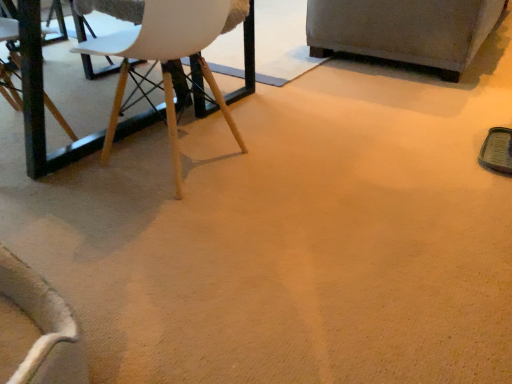
Where is `white matte chair at upper left`? The image size is (512, 384). white matte chair at upper left is located at coordinates (160, 55).

Describe the element at coordinates (160, 55) in the screenshot. I see `white matte chair at upper left` at that location.

Measure the distance between white matte chair at upper left and camera.

The depth of white matte chair at upper left is 3.60 feet.

The width and height of the screenshot is (512, 384). Describe the element at coordinates (404, 30) in the screenshot. I see `velvet gray armchair at upper right` at that location.

This screenshot has width=512, height=384. Find the location of `velvet gray armchair at upper right`. velvet gray armchair at upper right is located at coordinates (404, 30).

I want to click on white matte chair at upper left, so click(160, 55).

Is velvet gray armchair at upper right to the right of white matte chair at upper left from the viewer's perspective?

Yes.

Who is more distant, velvet gray armchair at upper right or white matte chair at upper left?

velvet gray armchair at upper right is further away from the camera.

Is point (464, 44) positioned after point (202, 13)?

Yes.

From the image's perspective, does velvet gray armchair at upper right appear lower than white matte chair at upper left?

No, from the image's perspective, velvet gray armchair at upper right is not below white matte chair at upper left.

Looking at this image, from a real-world perspective, which object stands above the other?

white matte chair at upper left, from a real-world perspective.

Which object is wider, velvet gray armchair at upper right or white matte chair at upper left?

With larger width is velvet gray armchair at upper right.

Who is shorter, velvet gray armchair at upper right or white matte chair at upper left?

velvet gray armchair at upper right is shorter.

Between velvet gray armchair at upper right and white matte chair at upper left, which one has smaller size?

With smaller size is white matte chair at upper left.

Do you think velvet gray armchair at upper right is within white matte chair at upper left, or outside of it?

The correct answer is: outside.

Is velvet gray armchair at upper right far away from white matte chair at upper left?

That's right, there is a large distance between velvet gray armchair at upper right and white matte chair at upper left.

Is velvet gray armchair at upper right looking in the opposite direction of white matte chair at upper left?

No, white matte chair at upper left is not at the back of velvet gray armchair at upper right.

Measure the distance between velvet gray armchair at upper right and white matte chair at upper left.

A distance of 1.25 meters exists between velvet gray armchair at upper right and white matte chair at upper left.

Where is `chair positioned vertically above the velvet gray armchair at upper right (from a real-world perspective)`? This screenshot has height=384, width=512. chair positioned vertically above the velvet gray armchair at upper right (from a real-world perspective) is located at coordinates (160, 55).

Which is more to the left, white matte chair at upper left or velvet gray armchair at upper right?

white matte chair at upper left is more to the left.

Does white matte chair at upper left come behind velvet gray armchair at upper right?

No, white matte chair at upper left is in front of velvet gray armchair at upper right.

Is point (104, 154) in front of point (339, 25)?

Yes.

From the image's perspective, who appears lower, white matte chair at upper left or velvet gray armchair at upper right?

white matte chair at upper left, from the image's perspective.

From a real-world perspective, between white matte chair at upper left and velvet gray armchair at upper right, who is vertically lower?

From a 3D spatial view, velvet gray armchair at upper right is below.

Which of these two, white matte chair at upper left or velvet gray armchair at upper right, is thinner?

With smaller width is white matte chair at upper left.

Which of these two, white matte chair at upper left or velvet gray armchair at upper right, stands shorter?

Standing shorter between the two is velvet gray armchair at upper right.

Based on the photo, considering the sizes of white matte chair at upper left and velvet gray armchair at upper right in the image, is white matte chair at upper left bigger or smaller than velvet gray armchair at upper right?

white matte chair at upper left is smaller than velvet gray armchair at upper right.

Do you think white matte chair at upper left is within velvet gray armchair at upper right, or outside of it?

white matte chair at upper left cannot be found inside velvet gray armchair at upper right.

Is white matte chair at upper left next to velvet gray armchair at upper right and touching it?

No, white matte chair at upper left is not in contact with velvet gray armchair at upper right.

Is white matte chair at upper left aimed at velvet gray armchair at upper right?

No, white matte chair at upper left is not oriented towards velvet gray armchair at upper right.

Can you tell me how much white matte chair at upper left and velvet gray armchair at upper right differ in facing direction?

The angular difference between white matte chair at upper left and velvet gray armchair at upper right is 2.23 degrees.

Where is `armchair directly beneath the white matte chair at upper left (from a real-world perspective)`? The height and width of the screenshot is (384, 512). armchair directly beneath the white matte chair at upper left (from a real-world perspective) is located at coordinates (404, 30).

At what (x,y) coordinates should I click in order to perform the action: click on chair above the velvet gray armchair at upper right (from a real-world perspective). Please return your answer as a coordinate pair (x, y). This screenshot has width=512, height=384. Looking at the image, I should click on (160, 55).

You are a GUI agent. You are given a task and a screenshot of the screen. Output one action in this format:
    pyautogui.click(x=<x>, y=<y>)
    Task: Click on the armchair behind the white matte chair at upper left
    
    Given the screenshot: What is the action you would take?
    pyautogui.click(x=404, y=30)